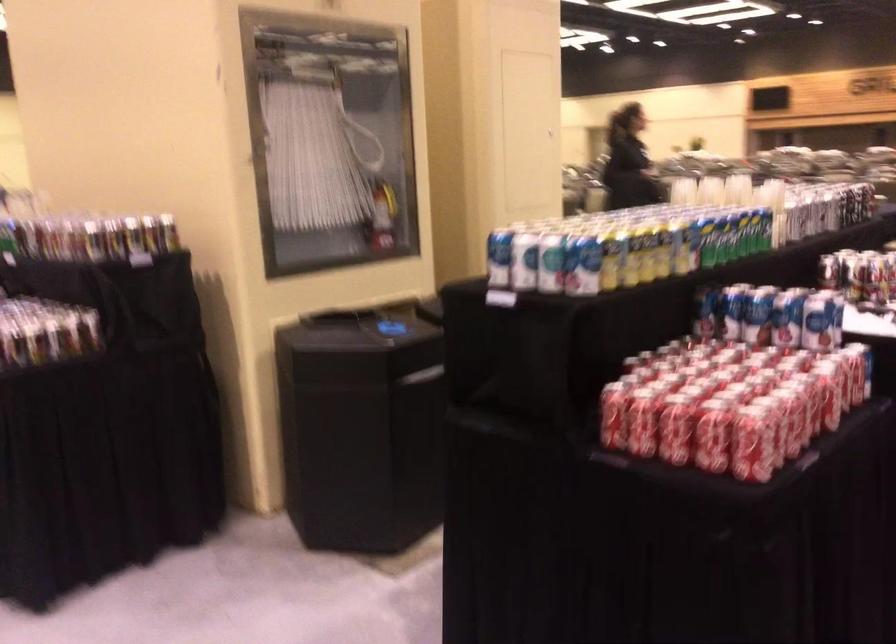
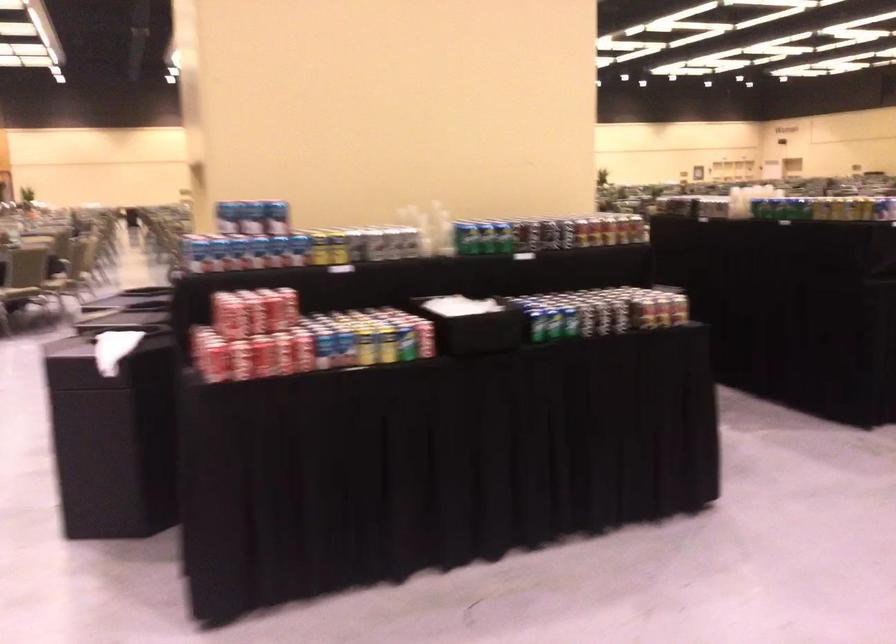
Question: I am providing you with two images of the same scene from different viewpoints. Which of the following objects are not visible in image2?

Choices:
 (A) fire hose nozzle
 (B) metal decorative bowl
 (C) silver soda can
 (D) black napkin holder

Answer: (A)